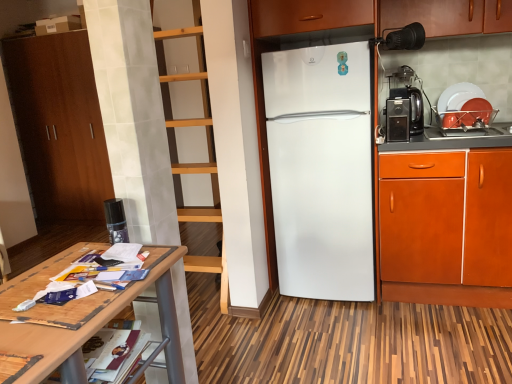
Find the location of `free spot to the right of black plastic coffee machine at right`. free spot to the right of black plastic coffee machine at right is located at coordinates (436, 135).